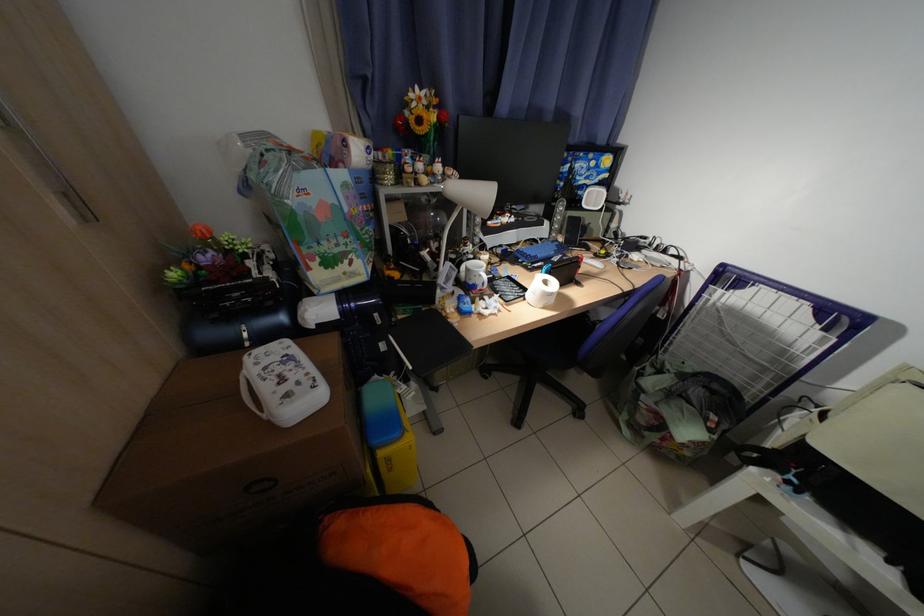
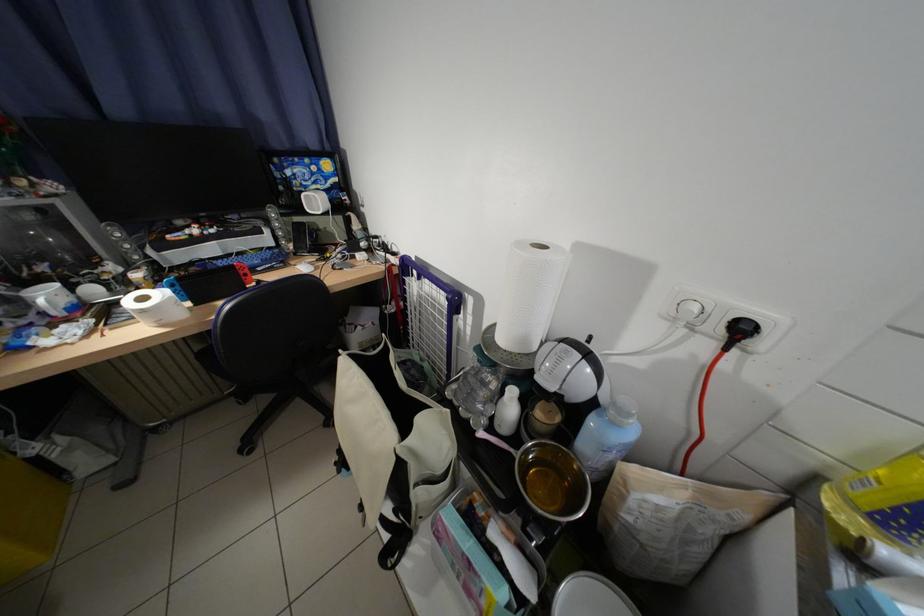
Question: In a continuous first-person perspective shot, in which direction is the camera moving?

Choices:
 (A) Left
 (B) Right
 (C) Forward
 (D) Backward

Answer: (B)